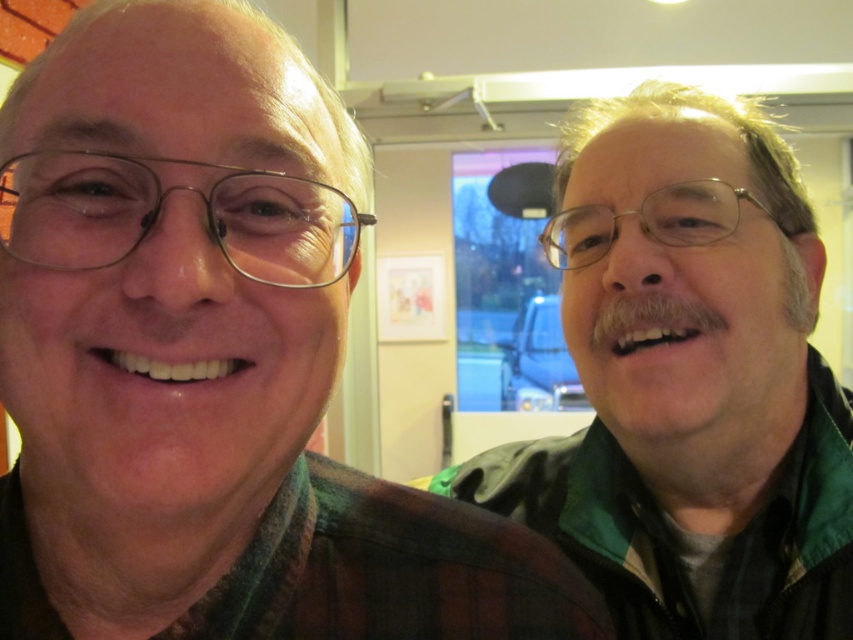
Question: Is green plaid shirt at upper right smaller than green matte jacket at right?

Choices:
 (A) yes
 (B) no

Answer: (A)

Question: Does green plaid shirt at upper right have a smaller size compared to green matte jacket at right?

Choices:
 (A) yes
 (B) no

Answer: (A)

Question: Which object appears farthest from the camera in this image?

Choices:
 (A) green matte jacket at right
 (B) green plaid shirt at upper right

Answer: (A)

Question: Which of the following is the closest to the observer?

Choices:
 (A) green plaid shirt at upper right
 (B) green matte jacket at right

Answer: (A)

Question: Can you confirm if green plaid shirt at upper right is positioned above green matte jacket at right?

Choices:
 (A) yes
 (B) no

Answer: (B)